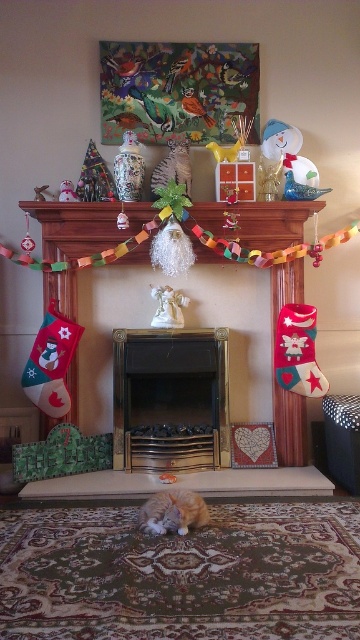
Question: Can you confirm if fluffy orange cat at lower center is smaller than matte ceramic vase at upper left?

Choices:
 (A) yes
 (B) no

Answer: (B)

Question: Which is nearer to the porcelain vase at upper center?

Choices:
 (A) white porcelain angel at center
 (B) gold metallic fireplace at center
 (C) fluffy orange cat at lower center

Answer: (A)

Question: Does white porcelain angel at center have a smaller size compared to matte ceramic vase at upper left?

Choices:
 (A) no
 (B) yes

Answer: (A)

Question: Is gold metallic fireplace at center positioned before matte ceramic vase at upper left?

Choices:
 (A) no
 (B) yes

Answer: (A)

Question: Estimate the real-world distances between objects in this image. Which object is closer to the porcelain vase at upper center?

Choices:
 (A) gold metallic fireplace at center
 (B) matte ceramic vase at upper left
 (C) white porcelain angel at center

Answer: (B)

Question: Which point appears closest to the camera in this image?

Choices:
 (A) (168, 308)
 (B) (117, 180)

Answer: (B)